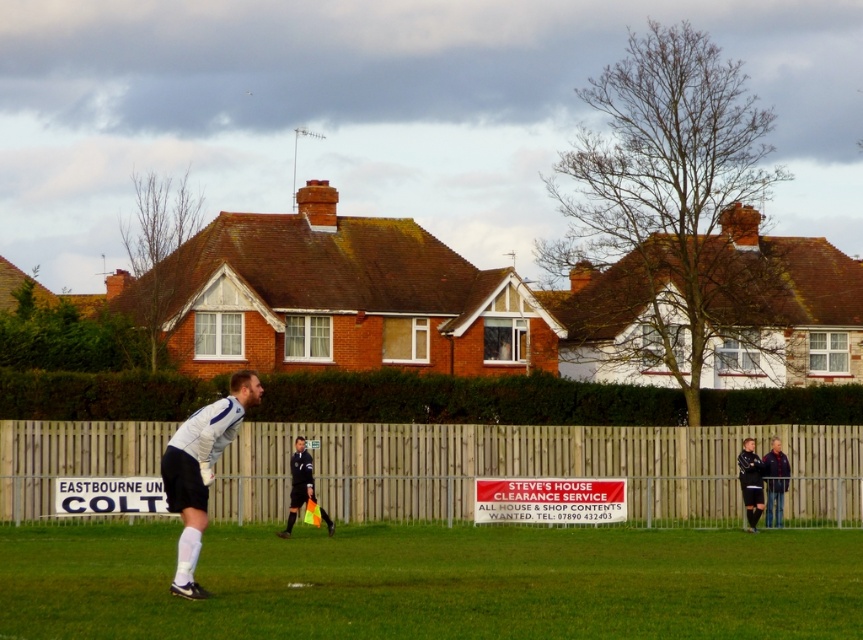
You are a soccer player positioned near the edge of the field. You notice the wooden fence at center and the dark blue jersey at center. Which object is closer to you?

The wooden fence at center is closer to you because it is in front of the dark blue jersey at center.

You are a photographer positioned at the edge of the soccer field. You want to take a photo that includes both the wooden fence at center and the dark blue jersey at center. Based on their positions, which object should you adjust your camera to focus on first to ensure both are in the frame?

The wooden fence at center is to the left of the dark blue jersey at center, so you should focus on the dark blue jersey at center first to ensure both are in the frame.

You are a soccer referee standing near the edge of the field. You see the neon yellow fabric flag at center and the dark blue jersey at center. Which object is closer to you?

The neon yellow fabric flag at center is closer to you because it is in front of the dark blue jersey at center.